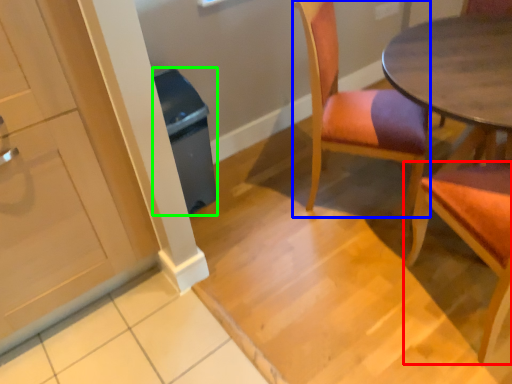
Question: Which object is positioned farthest from chair (highlighted by a red box)? Select from chair (highlighted by a blue box) and trash bin/can (highlighted by a green box).

Choices:
 (A) chair
 (B) trash bin/can

Answer: (B)